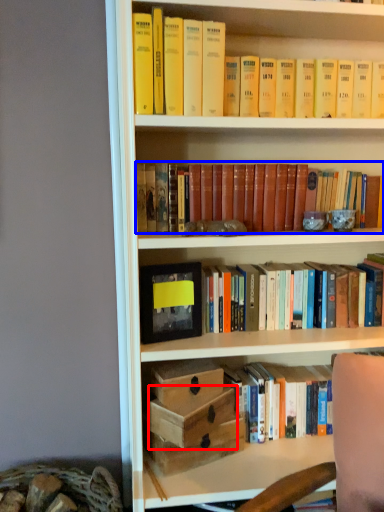
Question: Which object is further to the camera taking this photo, box (highlighted by a red box) or book (highlighted by a blue box)?

Choices:
 (A) box
 (B) book

Answer: (B)